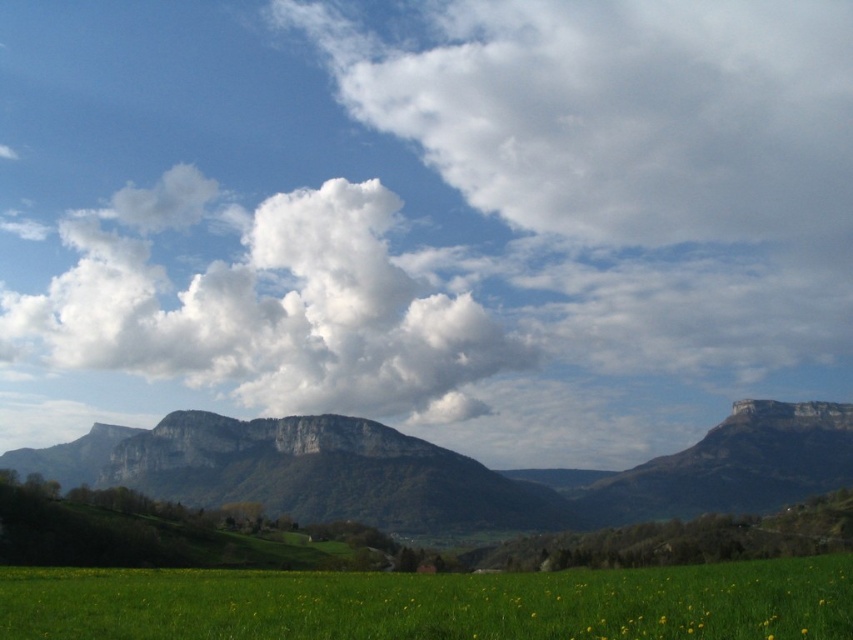
Is white fluffy cloud at upper center to the right of white fluffy cloud at center from the viewer's perspective?

Yes, white fluffy cloud at upper center is to the right of white fluffy cloud at center.

Between point (468, 10) and point (381, 348), which one is positioned in front?

Point (381, 348) is in front.

Find the location of a particular element. white fluffy cloud at upper center is located at coordinates (640, 160).

I want to click on white fluffy cloud at upper center, so click(x=640, y=160).

Which of these two, white fluffy cloud at upper center or green grassy field at lower center, stands shorter?

green grassy field at lower center

Describe the element at coordinates (640, 160) in the screenshot. I see `white fluffy cloud at upper center` at that location.

At what (x,y) coordinates should I click in order to perform the action: click on white fluffy cloud at upper center. Please return your answer as a coordinate pair (x, y). Looking at the image, I should click on (640, 160).

Is the position of white fluffy cloud at center more distant than that of green grassy field at lower center?

Yes, it is.

Is white fluffy cloud at center shorter than green grassy field at lower center?

No.

Who is more forward, (426, 332) or (308, 608)?

Point (308, 608) is more forward.

In order to click on white fluffy cloud at center in this screenshot , I will do `click(265, 307)`.